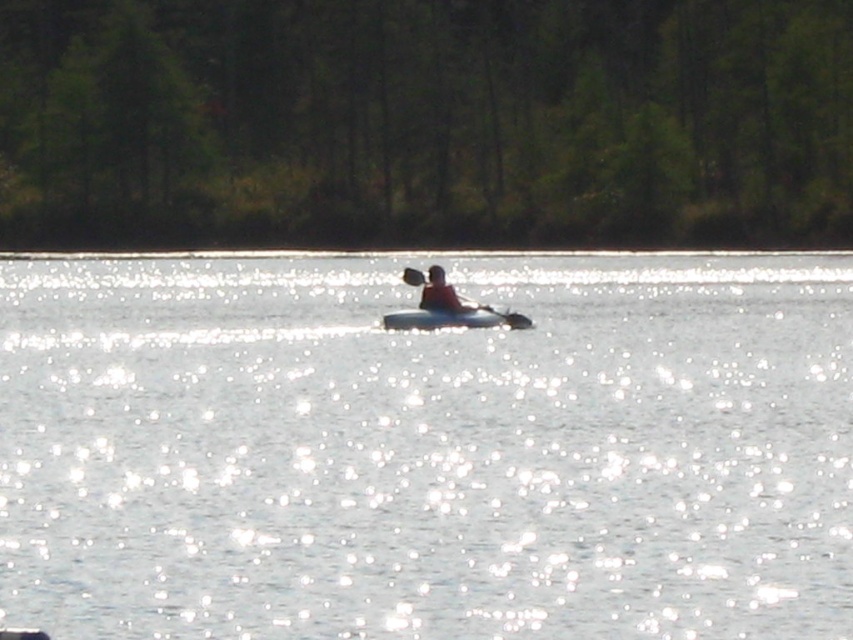
You are a photographer trying to capture the reflection of the black rubber paddle at center in the glistening water at center. Based on their positions, will the paddle be fully visible in its reflection?

The glistening water at center is taller than black rubber paddle at center, so the paddle will not be fully visible in its reflection since the water is higher than the paddle.

Based on the coordinates provided, where is the glistening water at center located in the image?

The glistening water at center is located at the coordinates point (426,449).